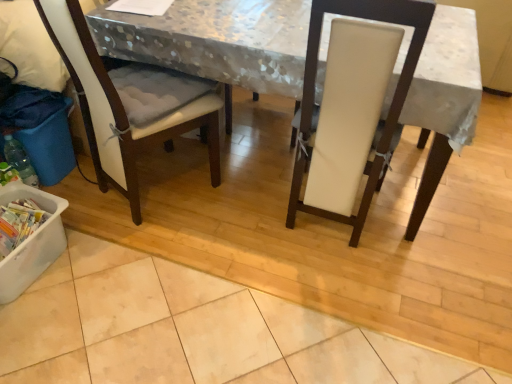
Image resolution: width=512 pixels, height=384 pixels. I want to click on vacant area that lies between white fabric chair at left, the second chair positioned from the right, and white fabric-covered table at center, so click(x=233, y=235).